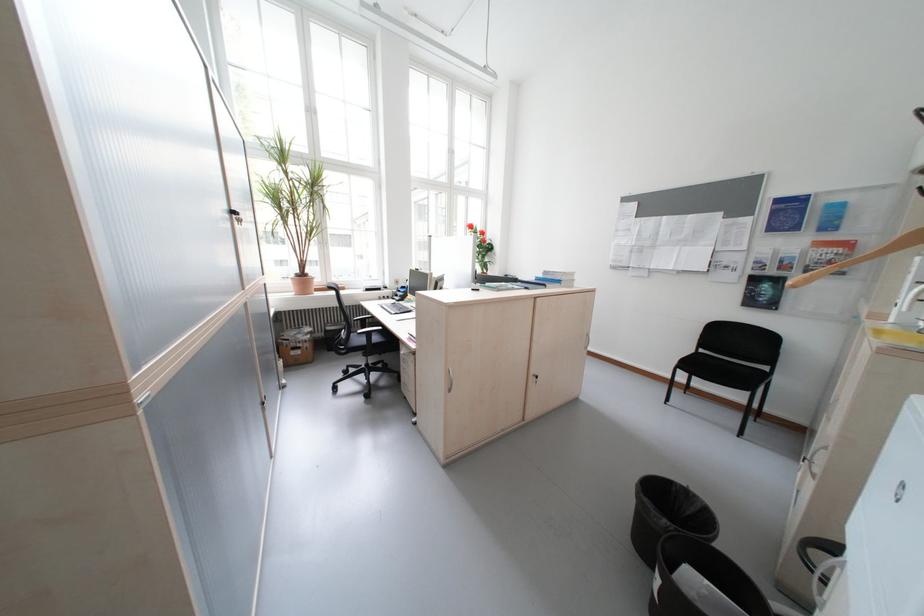
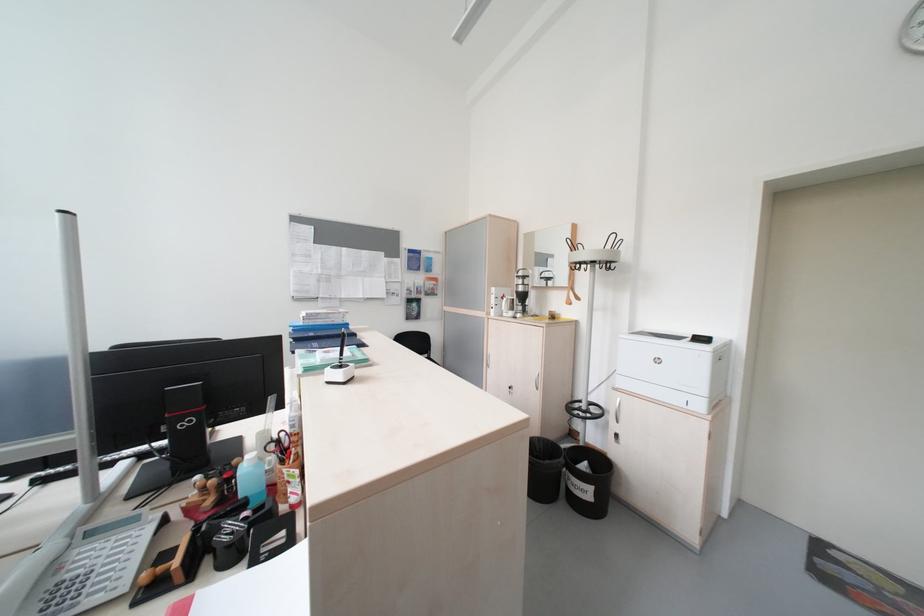
Question: I am providing you with two images of the same scene from different viewpoints. Which of the following objects are not visible in image2?

Choices:
 (A) red cabinet button
 (B) white printer lid
 (C) chair sitting surface
 (D) coat stand hook

Answer: (C)